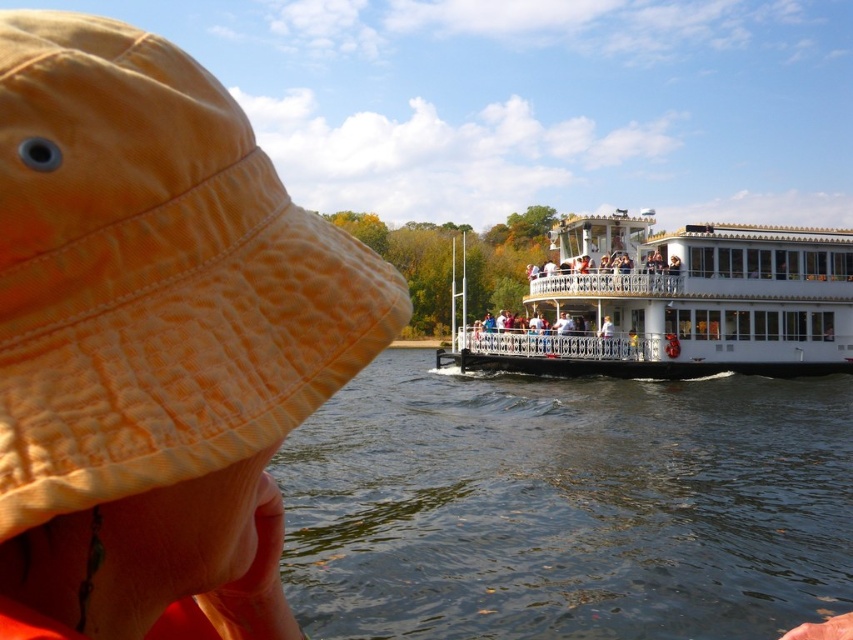
Question: Estimate the real-world distances between objects in this image. Which object is closer to the dark blue water at center?

Choices:
 (A) white glossy boat at center
 (B) orange cotton hat at left

Answer: (A)

Question: Is orange cotton hat at left thinner than white glossy boat at center?

Choices:
 (A) yes
 (B) no

Answer: (A)

Question: Which object is the closest to the dark blue water at center?

Choices:
 (A) white glossy boat at center
 (B) orange cotton hat at left

Answer: (A)

Question: Is dark blue water at center to the left of orange cotton hat at left from the viewer's perspective?

Choices:
 (A) no
 (B) yes

Answer: (A)

Question: Which point is closer to the camera?

Choices:
 (A) white glossy boat at center
 (B) orange cotton hat at left

Answer: (B)

Question: Does dark blue water at center appear over white glossy boat at center?

Choices:
 (A) yes
 (B) no

Answer: (B)